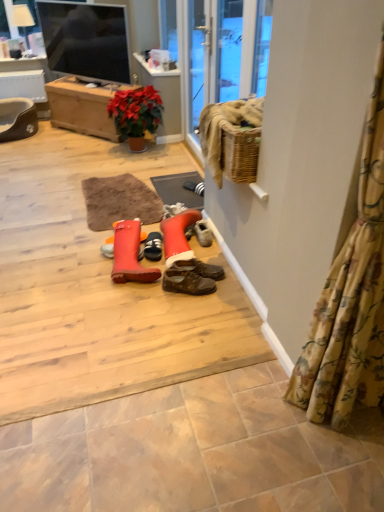
Question: Choose the correct answer: Is black rubber doormat at center inside floral fabric curtain at right or outside it?

Choices:
 (A) outside
 (B) inside

Answer: (A)

Question: Does point (173, 192) appear closer or farther from the camera than point (364, 218)?

Choices:
 (A) closer
 (B) farther

Answer: (B)

Question: Which of these objects is positioned closest to the brown leather shoes at center, the 1th footwear from the right?

Choices:
 (A) black rubber doormat at center
 (B) black suede shoe at center, which ranks as the second footwear in left-to-right order
 (C) flat screen tv at upper left
 (D) rubberized orange boot at center, which is the 1th footwear from left to right
 (E) matte beige tile at lower center

Answer: (D)

Question: Based on their relative distances, which object is nearer to the flat screen tv at upper left?

Choices:
 (A) white fabric lampshade at upper left
 (B) rubberized orange boot at center, which is the 1th footwear from left to right
 (C) brown leather shoes at center, the third footwear from the left
 (D) black rubber doormat at center
 (E) floral fabric curtain at right

Answer: (A)